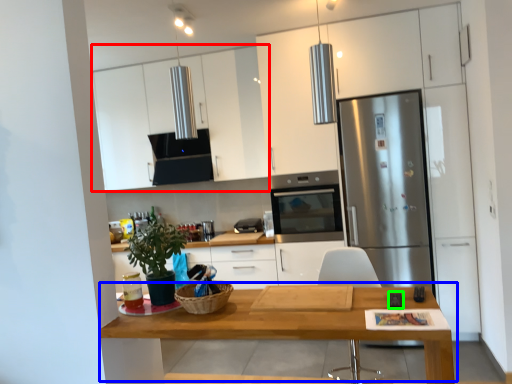
Question: Based on their relative distances, which object is nearer to cabinetry (highlighted by a red box)? Choose from table (highlighted by a blue box) and appliance (highlighted by a green box).

Choices:
 (A) table
 (B) appliance

Answer: (A)